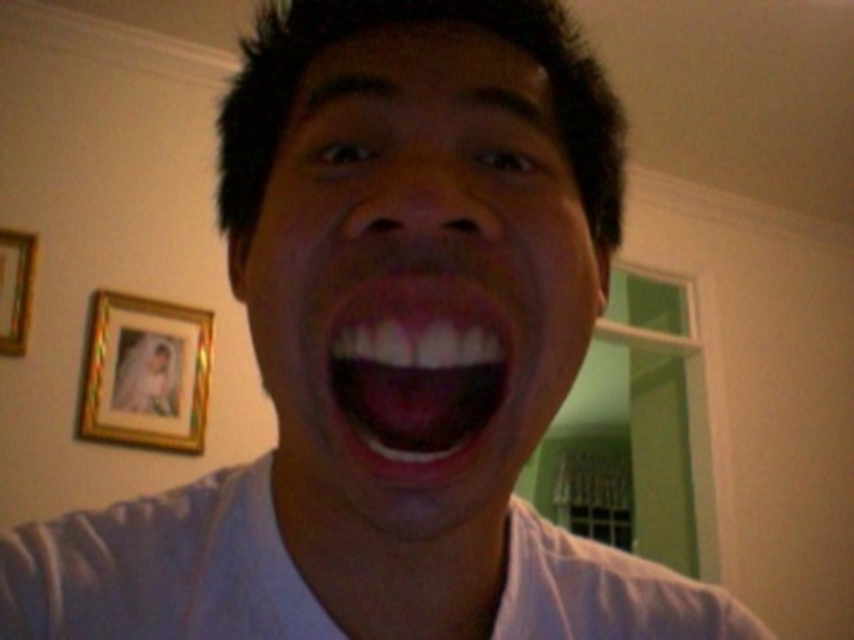
Can you confirm if matte white face at center is positioned to the left of gold wooden picture frame at left?

Incorrect, matte white face at center is not on the left side of gold wooden picture frame at left.

Is point (577, 312) farther from viewer compared to point (3, 230)?

No, (577, 312) is closer to viewer.

What are the coordinates of `matte white face at center` in the screenshot? It's located at (414, 282).

From the picture: Who is positioned more to the left, pink glossy lips at center or gold wooden picture frame at left?

gold wooden picture frame at left

How far apart are pink glossy lips at center and gold wooden picture frame at left?

They are 6.41 feet apart.

You are a GUI agent. You are given a task and a screenshot of the screen. Output one action in this format:
    pyautogui.click(x=<x>, y=<y>)
    Task: Click on the pink glossy lips at center
    
    Given the screenshot: What is the action you would take?
    pyautogui.click(x=417, y=372)

The height and width of the screenshot is (640, 854). In order to click on pink glossy lips at center in this screenshot , I will do `click(417, 372)`.

What do you see at coordinates (414, 282) in the screenshot? The height and width of the screenshot is (640, 854). I see `matte white face at center` at bounding box center [414, 282].

Is point (370, 147) in front of point (455, 364)?

That is False.

I want to click on matte white face at center, so click(x=414, y=282).